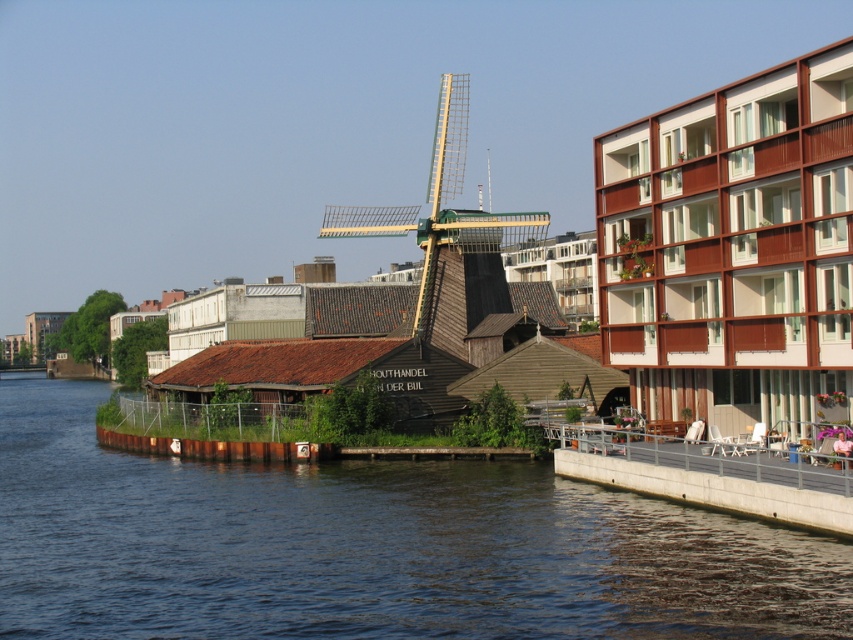
Does dark blue water at lower left have a lesser height compared to concrete gray dock at lower right?

Incorrect, dark blue water at lower left's height does not fall short of concrete gray dock at lower right's.

What do you see at coordinates (372, 547) in the screenshot?
I see `dark blue water at lower left` at bounding box center [372, 547].

Is point (0, 604) behind point (770, 458)?

No, (0, 604) is in front of (770, 458).

At what (x,y) coordinates should I click in order to perform the action: click on dark blue water at lower left. Please return your answer as a coordinate pair (x, y). Image resolution: width=853 pixels, height=640 pixels. Looking at the image, I should click on (372, 547).

Is concrete gray dock at lower right further to the viewer compared to wooden windmill at center?

No, concrete gray dock at lower right is in front of wooden windmill at center.

Is point (749, 481) farther from camera compared to point (442, 83)?

No, it is not.

Is point (666, 488) behind point (439, 118)?

No, (666, 488) is in front of (439, 118).

This screenshot has width=853, height=640. I want to click on concrete gray dock at lower right, so click(x=714, y=474).

Identify the location of dark blue water at lower left. (372, 547).